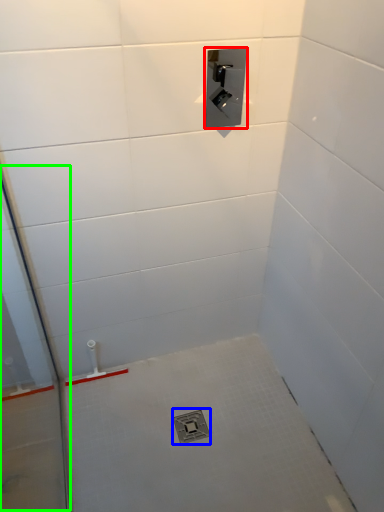
Question: Which object is positioned farthest from plumbing fixture (highlighted by a red box)? Select from drain (highlighted by a blue box) and glass door (highlighted by a green box).

Choices:
 (A) drain
 (B) glass door

Answer: (A)